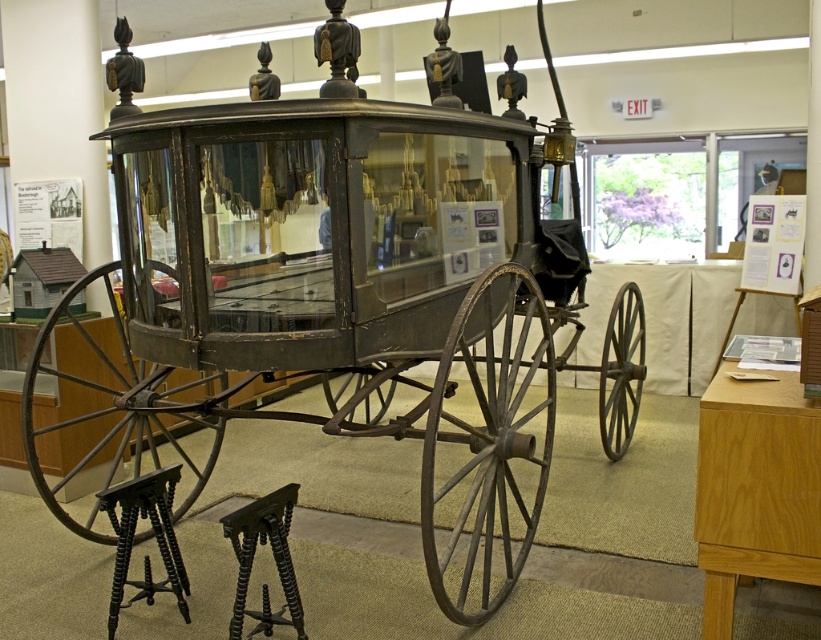
Question: Which point appears farthest from the camera in this image?

Choices:
 (A) (144, 596)
 (B) (273, 493)

Answer: (A)

Question: Is black wood stool at lower left smaller than black twisted wood stool at lower left?

Choices:
 (A) no
 (B) yes

Answer: (A)

Question: Is black wood stool at lower left below black twisted wood stool at lower left?

Choices:
 (A) yes
 (B) no

Answer: (B)

Question: Which of the following is the closest to the observer?

Choices:
 (A) (296, 630)
 (B) (99, 500)

Answer: (A)

Question: Can you confirm if black wood stool at lower left is smaller than black twisted wood stool at lower left?

Choices:
 (A) no
 (B) yes

Answer: (A)